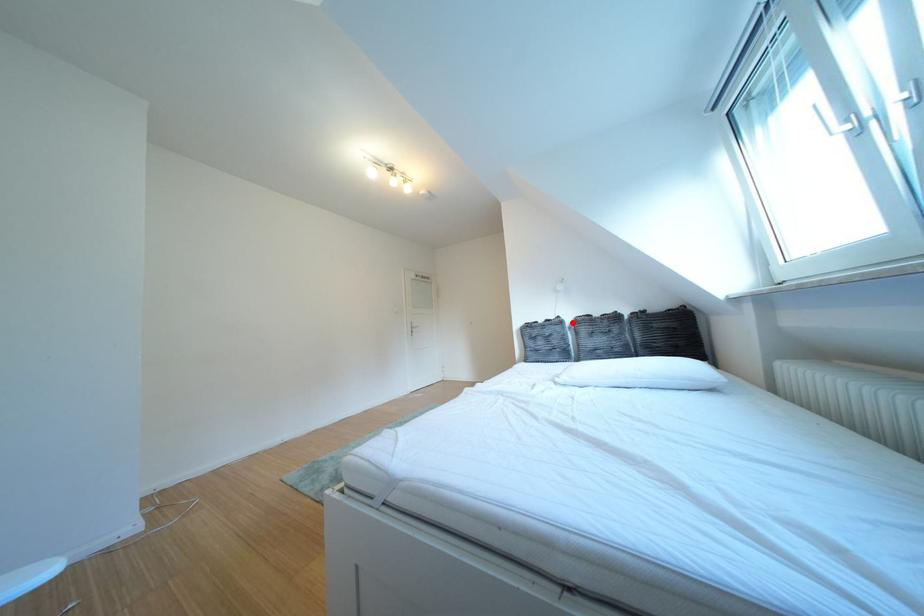
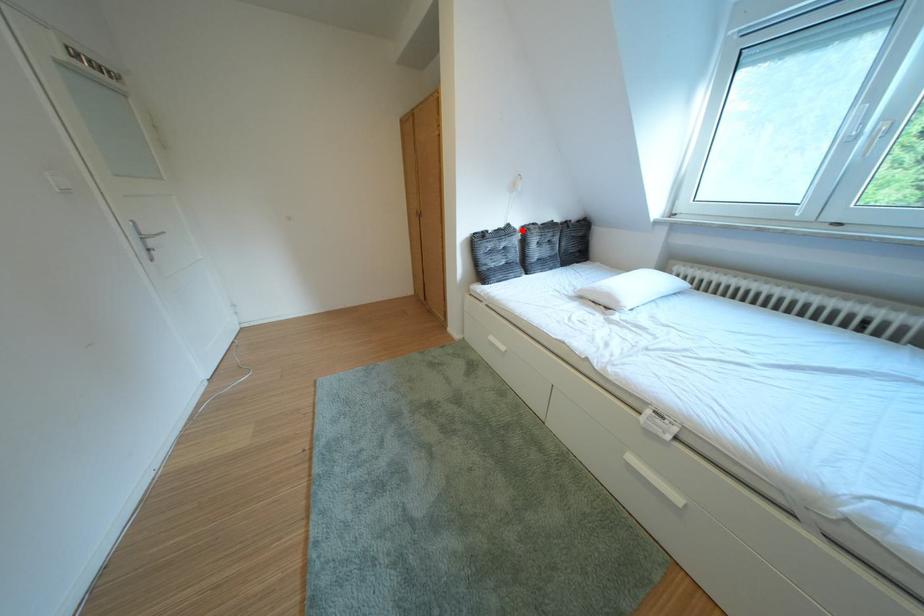
I am providing you with two images of the same scene from different viewpoints. A red point is marked on the first image and another point is marked on the second image. Is the marked point in image1 the same physical position as the marked point in image2?

Yes